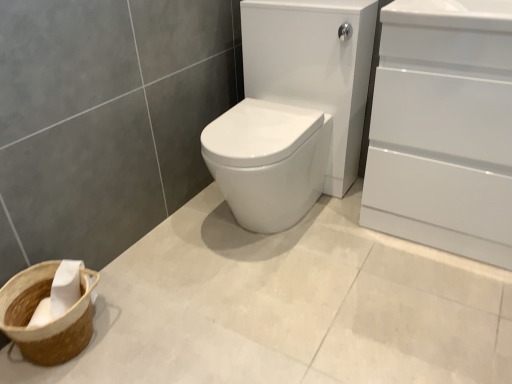
Question: Considering the relative sizes of white glossy sink at center and white glossy cabinet at right in the image provided, is white glossy sink at center thinner than white glossy cabinet at right?

Choices:
 (A) yes
 (B) no

Answer: (B)

Question: Considering the relative positions of white glossy sink at center and white glossy cabinet at right in the image provided, is white glossy sink at center to the left of white glossy cabinet at right from the viewer's perspective?

Choices:
 (A) no
 (B) yes

Answer: (B)

Question: From the image's perspective, is white glossy sink at center below white glossy cabinet at right?

Choices:
 (A) no
 (B) yes

Answer: (A)

Question: Is white glossy sink at center facing towards white glossy cabinet at right?

Choices:
 (A) yes
 (B) no

Answer: (B)

Question: Is white glossy sink at center located outside white glossy cabinet at right?

Choices:
 (A) no
 (B) yes

Answer: (B)

Question: From a real-world perspective, is white glossy cabinet at right physically located above or below white glossy sink at center?

Choices:
 (A) above
 (B) below

Answer: (A)

Question: Is white glossy cabinet at right bigger or smaller than white glossy sink at center?

Choices:
 (A) big
 (B) small

Answer: (B)

Question: Considering their positions, is white glossy cabinet at right located in front of or behind white glossy sink at center?

Choices:
 (A) front
 (B) behind

Answer: (A)

Question: Is white glossy cabinet at right wider or thinner than white glossy sink at center?

Choices:
 (A) thin
 (B) wide

Answer: (A)

Question: Which is correct: white glossy cabinet at right is inside brown woven basket at lower left, or outside of it?

Choices:
 (A) inside
 (B) outside

Answer: (B)

Question: Based on their sizes in the image, would you say white glossy cabinet at right is bigger or smaller than brown woven basket at lower left?

Choices:
 (A) small
 (B) big

Answer: (B)

Question: Is point (402, 51) positioned closer to the camera than point (48, 359)?

Choices:
 (A) farther
 (B) closer

Answer: (A)

Question: From a real-world perspective, is white glossy cabinet at right physically located above or below brown woven basket at lower left?

Choices:
 (A) above
 (B) below

Answer: (A)

Question: Relative to white glossy cabinet at right, is white glossy sink at center in front or behind?

Choices:
 (A) front
 (B) behind

Answer: (B)

Question: From a real-world perspective, is white glossy sink at center physically located above or below white glossy cabinet at right?

Choices:
 (A) above
 (B) below

Answer: (B)